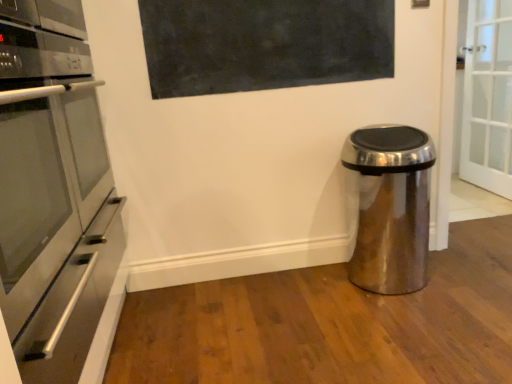
Question: Does satin metallic trash can at lower right have a larger size compared to stainless steel oven at left?

Choices:
 (A) yes
 (B) no

Answer: (B)

Question: Is satin metallic trash can at lower right in front of stainless steel oven at left?

Choices:
 (A) no
 (B) yes

Answer: (A)

Question: Does satin metallic trash can at lower right have a smaller size compared to stainless steel oven at left?

Choices:
 (A) no
 (B) yes

Answer: (B)

Question: Does satin metallic trash can at lower right appear on the right side of stainless steel oven at left?

Choices:
 (A) no
 (B) yes

Answer: (B)

Question: Is satin metallic trash can at lower right oriented towards stainless steel oven at left?

Choices:
 (A) yes
 (B) no

Answer: (B)

Question: From the image's perspective, is satin metallic trash can at lower right above or below matte black board at upper center?

Choices:
 (A) above
 (B) below

Answer: (B)

Question: Does point (385, 289) appear closer or farther from the camera than point (265, 69)?

Choices:
 (A) farther
 (B) closer

Answer: (A)

Question: Is satin metallic trash can at lower right in front of or behind matte black board at upper center in the image?

Choices:
 (A) front
 (B) behind

Answer: (A)

Question: From their relative heights in the image, would you say satin metallic trash can at lower right is taller or shorter than matte black board at upper center?

Choices:
 (A) tall
 (B) short

Answer: (A)

Question: Looking at their shapes, would you say matte black board at upper center is wider or thinner than satin metallic trash can at lower right?

Choices:
 (A) wide
 (B) thin

Answer: (B)

Question: Is matte black board at upper center in front of or behind satin metallic trash can at lower right in the image?

Choices:
 (A) behind
 (B) front

Answer: (A)

Question: Is matte black board at upper center taller or shorter than satin metallic trash can at lower right?

Choices:
 (A) short
 (B) tall

Answer: (A)

Question: From a real-world perspective, is matte black board at upper center above or below satin metallic trash can at lower right?

Choices:
 (A) above
 (B) below

Answer: (A)

Question: From the image's perspective, is matte black board at upper center above or below stainless steel oven at left?

Choices:
 (A) below
 (B) above

Answer: (B)

Question: Considering their positions, is matte black board at upper center located in front of or behind stainless steel oven at left?

Choices:
 (A) behind
 (B) front

Answer: (A)